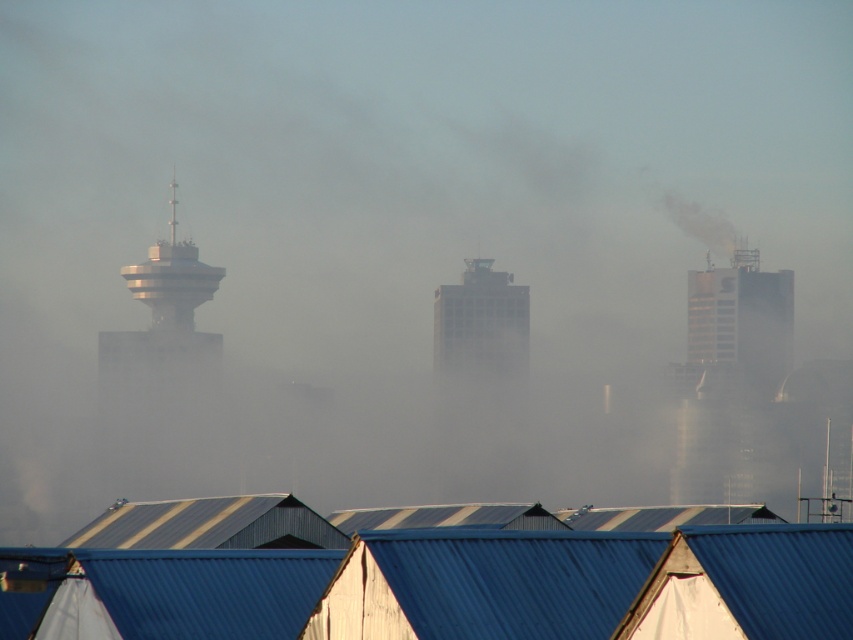
You are a city planner analyzing the urban layout. You observe a point at coordinates (x=445, y=586). Based on the scene, what does this point indicate?

The point at coordinates (x=445, y=586) marks the blue corrugated metal at lower center.

You are a delivery drone flying over the city. You need to deliver a package to the gray concrete building at center. There is a blue corrugated metal at lower center in your path. Which direction should you adjust your flight path to avoid it?

The blue corrugated metal at lower center is to the left of the gray concrete building at center. To avoid it, you should adjust your flight path to the right.